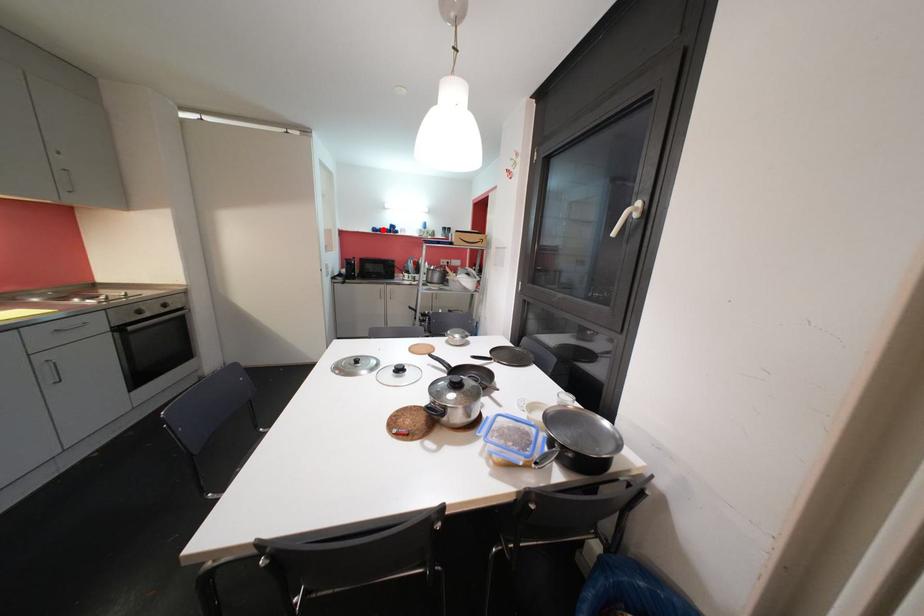
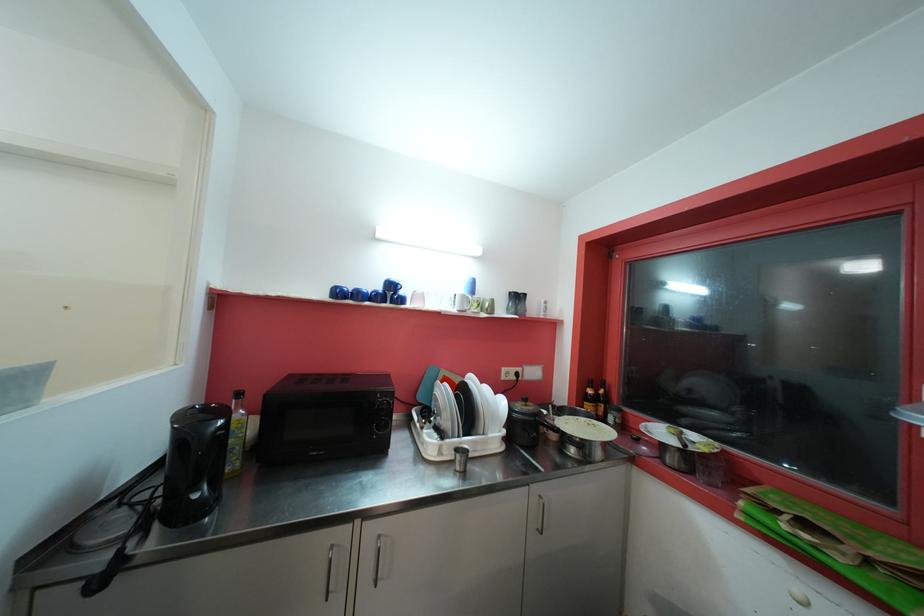
Locate, in the second image, the point that corresponds to the highlighted location in the first image.

(354, 290)